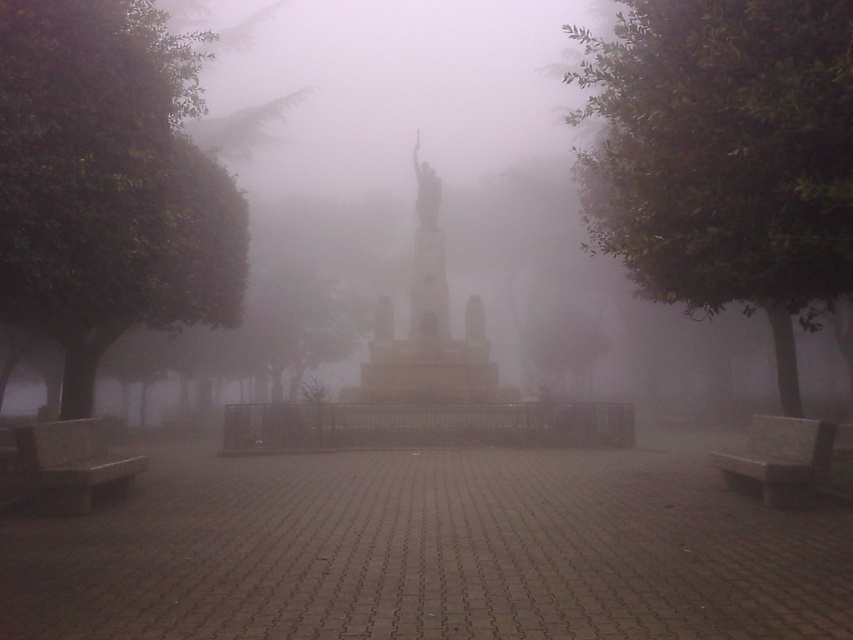
Question: Estimate the real-world distances between objects in this image. Which object is closer to the green leafy tree at left?

Choices:
 (A) green leafy tree at right
 (B) gray stone bench at lower right
 (C) smooth gray bench at lower left

Answer: (C)

Question: Can you confirm if stone statue at center is bigger than smooth gray bench at lower left?

Choices:
 (A) no
 (B) yes

Answer: (B)

Question: Can you confirm if green leafy tree at right is positioned to the left of smooth gray bench at lower left?

Choices:
 (A) no
 (B) yes

Answer: (A)

Question: Can you confirm if green leafy tree at left is positioned to the right of stone statue at center?

Choices:
 (A) yes
 (B) no

Answer: (B)

Question: Which point is farther from the camera taking this photo?

Choices:
 (A) (216, 310)
 (B) (767, 205)
 (C) (416, 172)
 (D) (85, 508)

Answer: (C)

Question: Estimate the real-world distances between objects in this image. Which object is farther from the green leafy tree at right?

Choices:
 (A) gray stone bench at lower right
 (B) foggy stone monument at center
 (C) green leafy tree at left

Answer: (B)